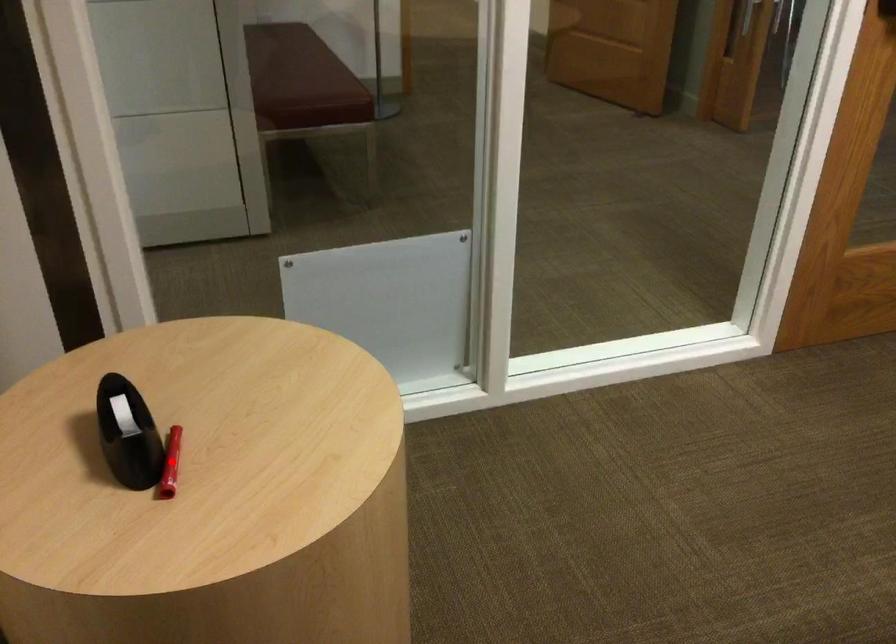
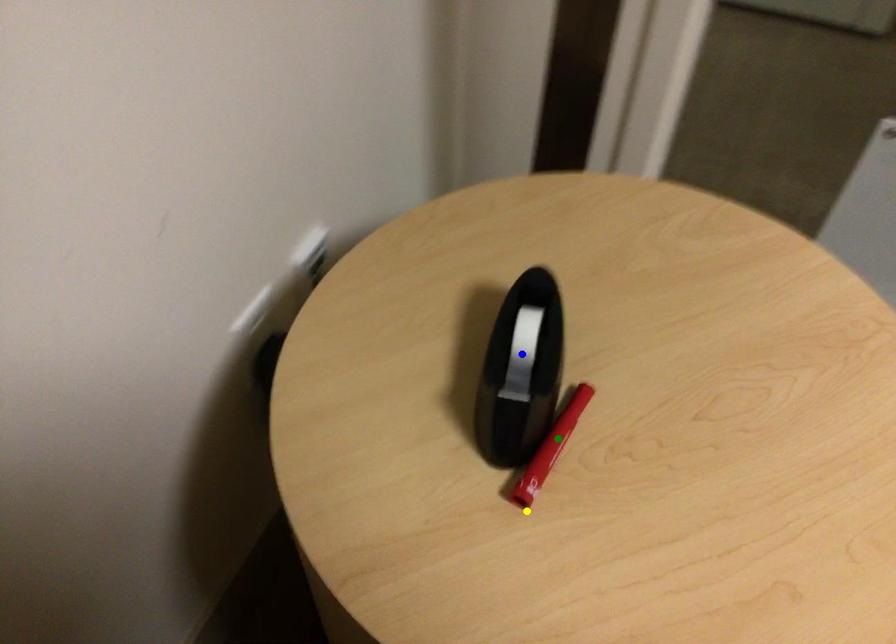
Question: I am providing you with two images of the same scene from different viewpoints. A red point is marked on the first image. You are given multiple points on the second image. Which point in image 2 represents the same 3d spot as the red point in image 1?

Choices:
 (A) blue point
 (B) green point
 (C) yellow point

Answer: (B)